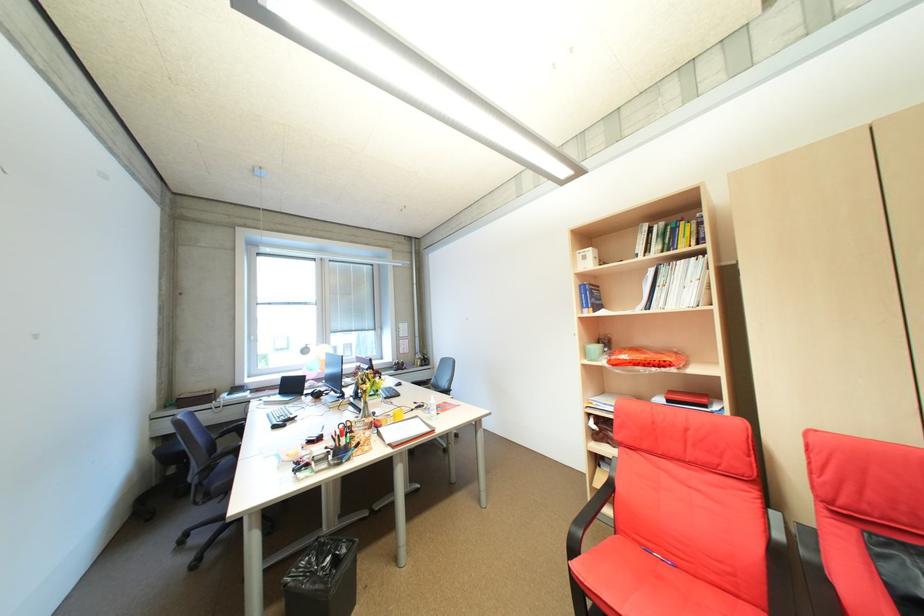
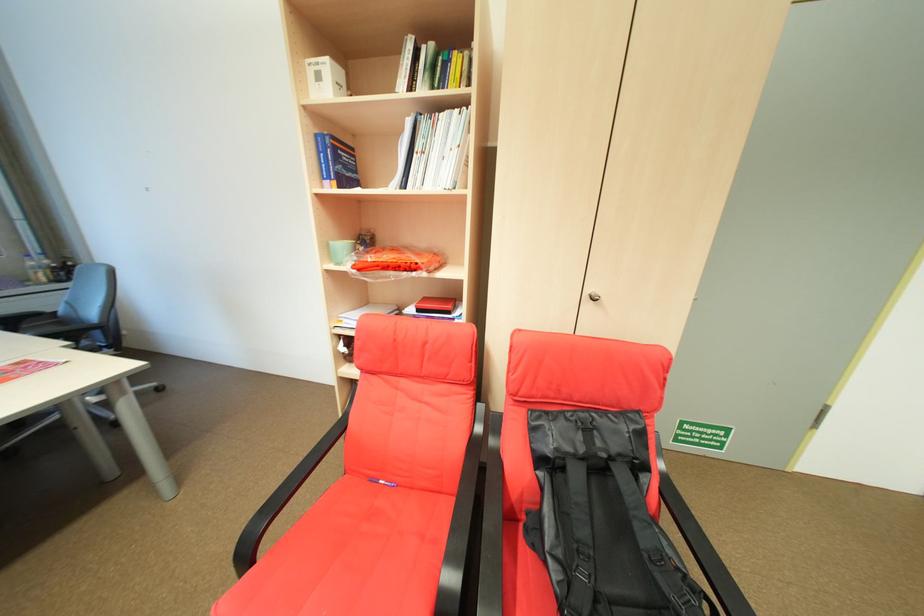
Find the pixel in the second image that matches pixel 600 291 in the first image.

(344, 148)